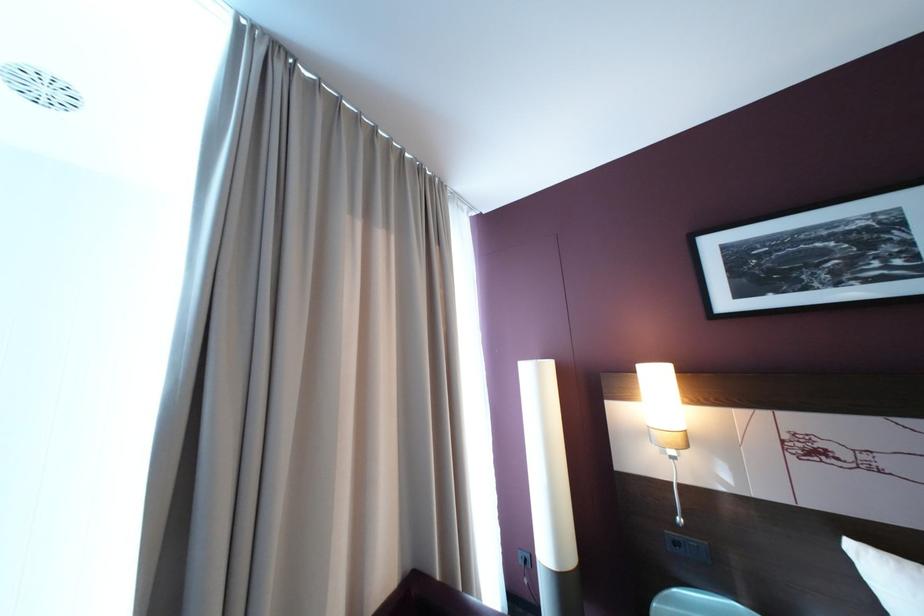
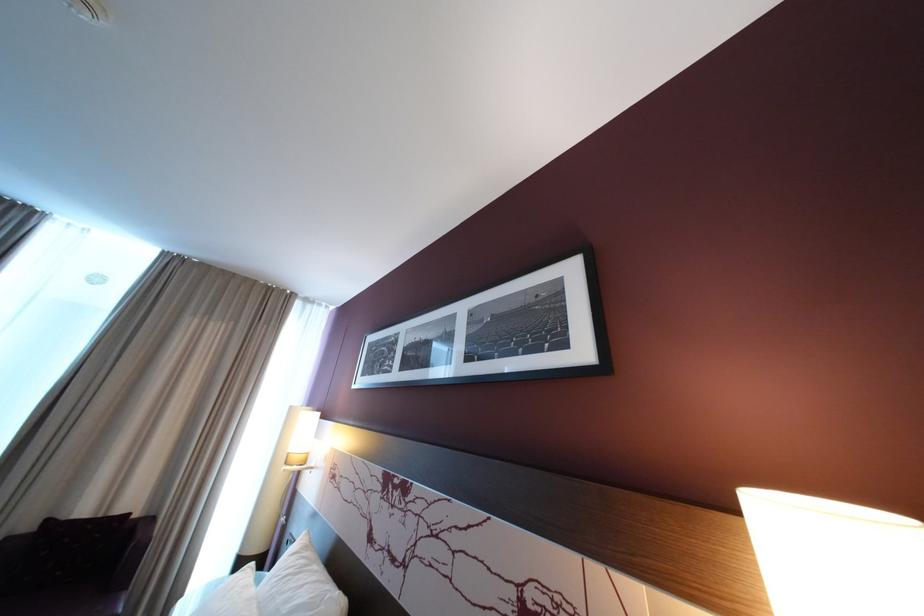
Question: In a continuous first-person perspective shot, in which direction is the camera moving?

Choices:
 (A) Left
 (B) Right
 (C) Forward
 (D) Backward

Answer: (B)